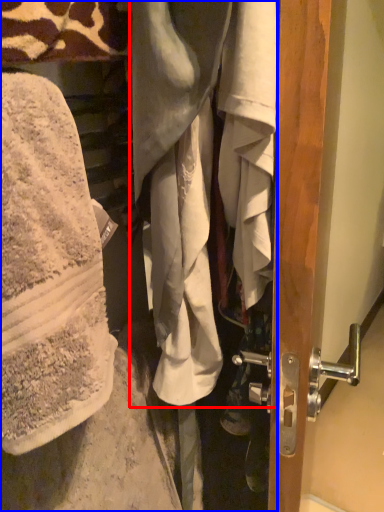
Question: Among these objects, which one is farthest to the camera, wrap (highlighted by a red box) or wrap (highlighted by a blue box)?

Choices:
 (A) wrap
 (B) wrap

Answer: (A)